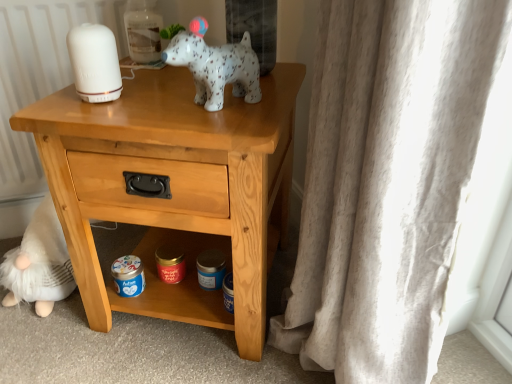
What are the coordinates of `free space to the left of white speckled ceramic dog at upper center` in the screenshot? It's located at (130, 102).